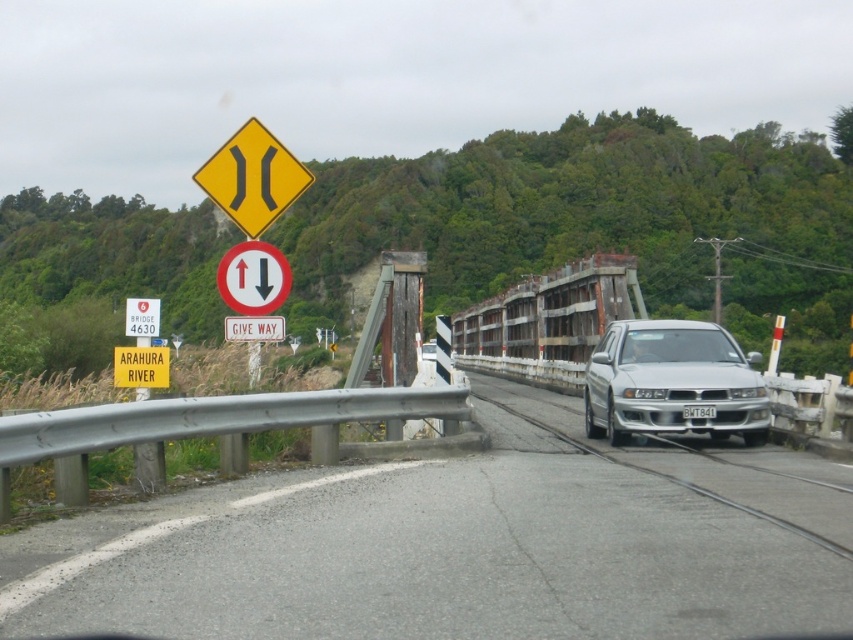
Question: Does yellow diamond at upper center have a greater width compared to white plastic license plate at center?

Choices:
 (A) no
 (B) yes

Answer: (B)

Question: Is metallic gray train track at center positioned before yellow plastic speed limit sign at upper left?

Choices:
 (A) yes
 (B) no

Answer: (A)

Question: Which point appears farthest from the camera in this image?

Choices:
 (A) (701, 419)
 (B) (463, 548)
 (C) (587, 429)
 (D) (686, 449)

Answer: (C)

Question: Among these points, which one is farthest from the camera?

Choices:
 (A) (637, 490)
 (B) (148, 308)
 (C) (242, 209)
 (D) (664, 342)

Answer: (D)

Question: Which point is farther to the camera?

Choices:
 (A) gray asphalt road at center
 (B) yellow plastic speed limit sign at upper left
 (C) white plastic license plate at center
 (D) yellow diamond at upper center

Answer: (C)

Question: Does gray asphalt road at center come in front of yellow plastic speed limit sign at upper left?

Choices:
 (A) yes
 (B) no

Answer: (A)